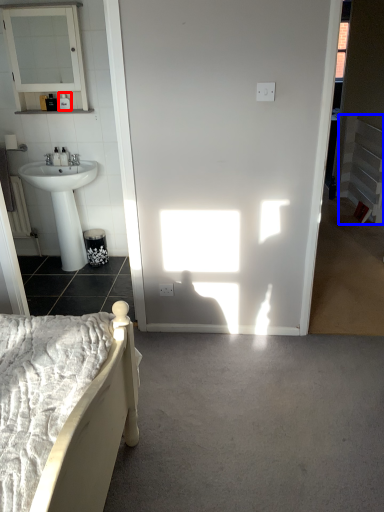
Question: Which object is further to the camera taking this photo, toiletry (highlighted by a red box) or balustrade (highlighted by a blue box)?

Choices:
 (A) toiletry
 (B) balustrade

Answer: (B)